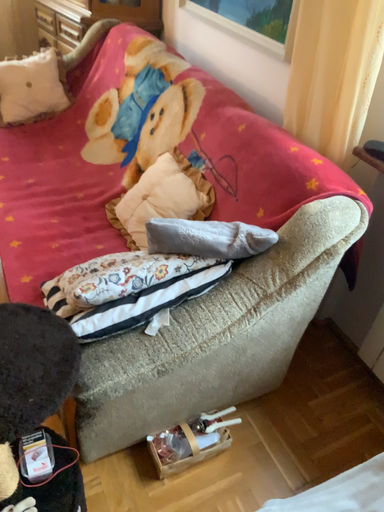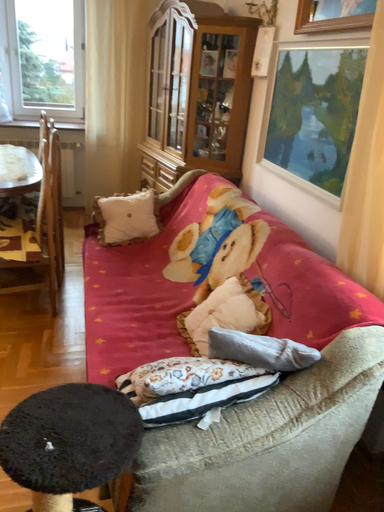
Question: Which way did the camera rotate in the video?

Choices:
 (A) rotated right
 (B) rotated left

Answer: (B)